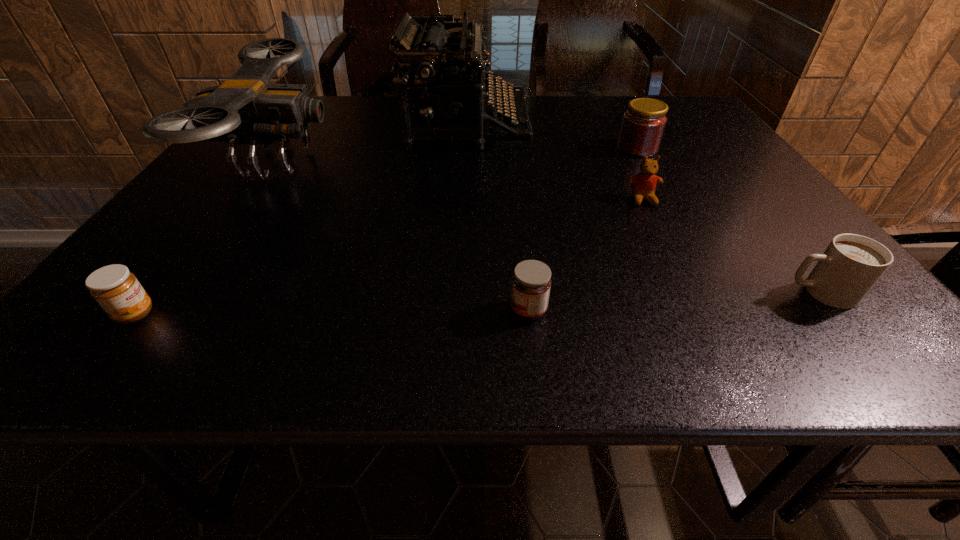
I want to click on vacant space located on the left of the rightmost jam, so click(x=583, y=148).

Identify the location of blank space located on the front-facing side of the teddy bear. (675, 266).

Find the location of a particular element. free space located on the side with the handle of the rightmost object is located at coordinates (704, 292).

Image resolution: width=960 pixels, height=540 pixels. Identify the location of vacant space located 0.080m on the side with the handle of the rightmost object. (738, 292).

Identify the location of vacant space positioned on the side with the handle of the rightmost object. (612, 292).

In order to click on free space located on the right of the second jam from right to left in this screenshot , I will do `click(608, 310)`.

Identify the location of free space located on the front label of the leftmost jam. The width and height of the screenshot is (960, 540). pos(311,314).

Image resolution: width=960 pixels, height=540 pixels. What are the coordinates of `typewriter that is at the far edge` in the screenshot? It's located at (430, 110).

At what (x,y) coordinates should I click in order to perform the action: click on drone present at the far edge. Please return your answer as a coordinate pair (x, y). This screenshot has width=960, height=540. Looking at the image, I should click on (246, 109).

Find the location of a particular element. The height and width of the screenshot is (540, 960). drone that is at the left edge is located at coordinates (246, 109).